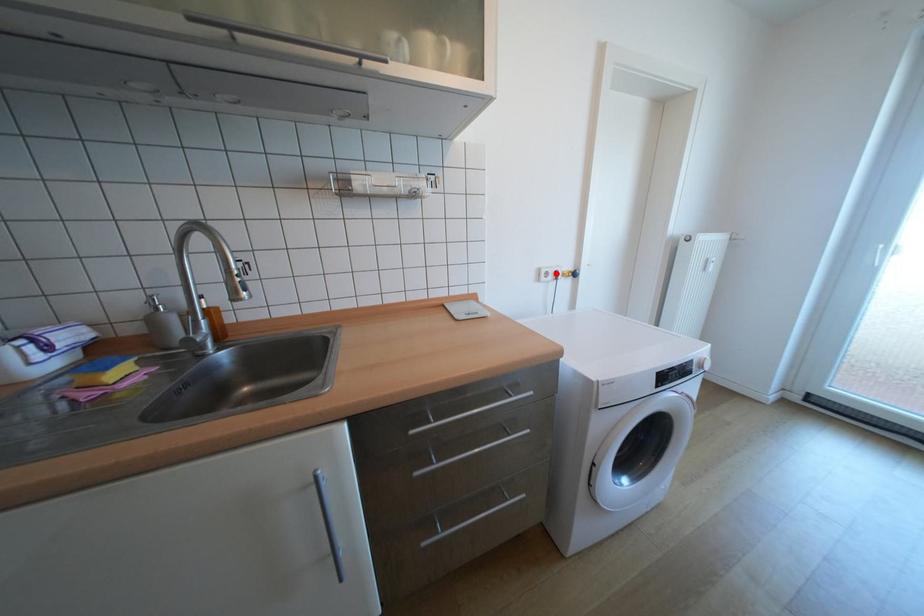
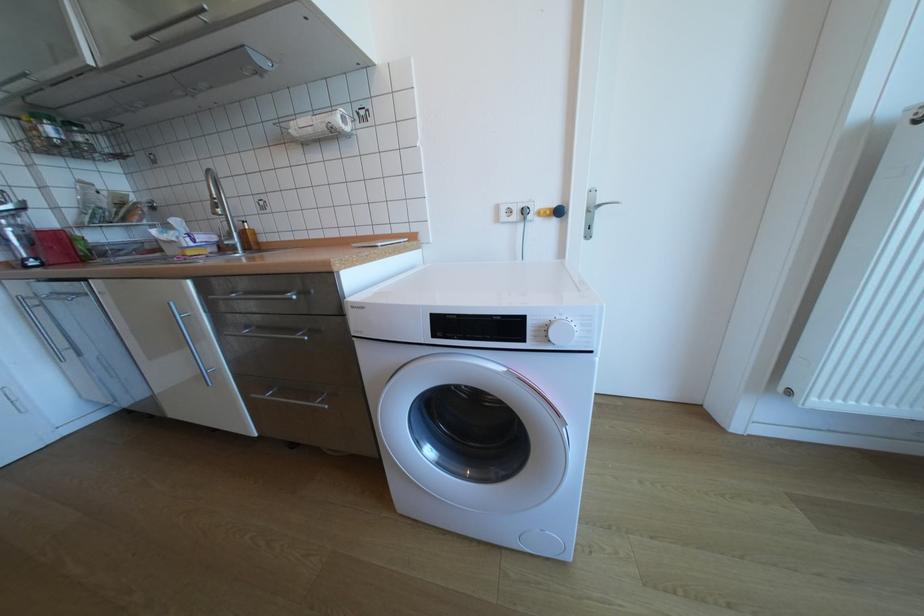
Where in the second image is the point corresponding to the highlighted location from the first image?

(518, 211)